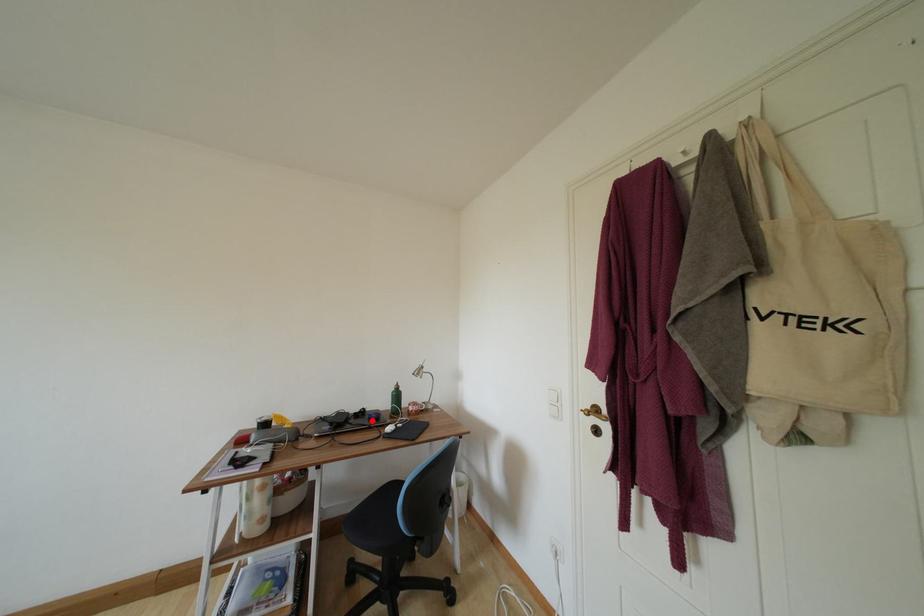
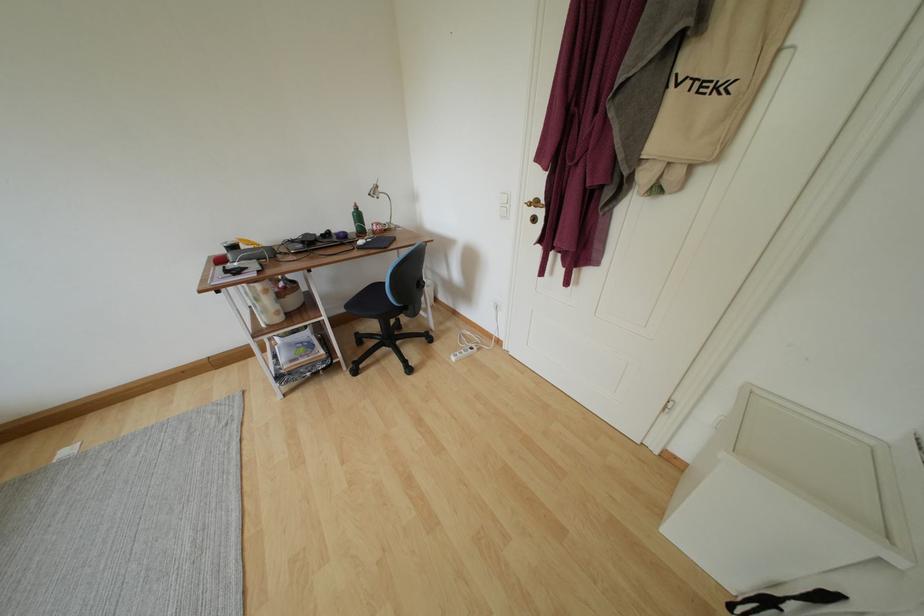
Locate, in the second image, the point that corresponds to the highlighted location in the first image.

(339, 241)